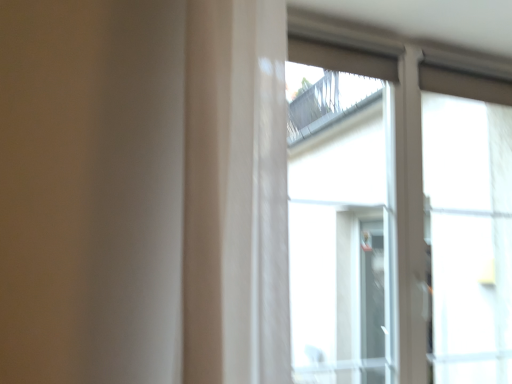
At what (x,y) coordinates should I click in order to perform the action: click on transparent glass window at upper right. Please return your answer as a coordinate pair (x, y). Image resolution: width=512 pixels, height=384 pixels. Looking at the image, I should click on click(x=398, y=221).

What is the approximate height of transparent glass window at upper right?

transparent glass window at upper right is 4.34 feet tall.

Describe the element at coordinates (398, 221) in the screenshot. Image resolution: width=512 pixels, height=384 pixels. I see `transparent glass window at upper right` at that location.

You are a GUI agent. You are given a task and a screenshot of the screen. Output one action in this format:
    pyautogui.click(x=<x>, y=<y>)
    Task: Click on the transparent glass window at upper right
    Image resolution: width=512 pixels, height=384 pixels.
    Given the screenshot: What is the action you would take?
    pyautogui.click(x=398, y=221)